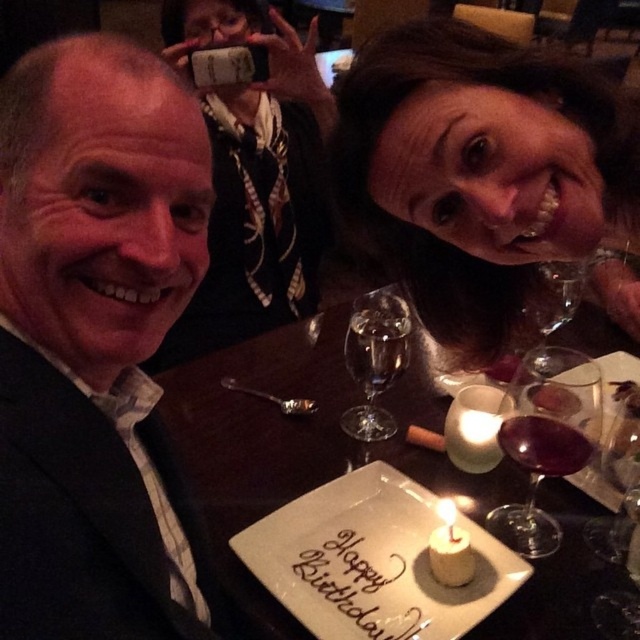
Between transparent glass wine glass at lower right and white wax candle at center, which one is positioned higher?

Positioned higher is transparent glass wine glass at lower right.

Is transparent glass wine glass at lower right smaller than white wax candle at center?

No.

This screenshot has width=640, height=640. I want to click on transparent glass wine glass at lower right, so click(x=620, y=477).

You are a GUI agent. You are given a task and a screenshot of the screen. Output one action in this format:
    pyautogui.click(x=<x>, y=<y>)
    Task: Click on the transparent glass wine glass at lower right
    The width and height of the screenshot is (640, 640).
    Given the screenshot: What is the action you would take?
    pyautogui.click(x=620, y=477)

Which of these two, clear glass wine glass at center or white wax candle at center, stands shorter?

With less height is white wax candle at center.

Can you confirm if clear glass wine glass at center is positioned above white wax candle at center?

Yes, clear glass wine glass at center is above white wax candle at center.

Locate an element on the screen. The image size is (640, 640). clear glass wine glass at center is located at coordinates (376, 358).

Between clear glass wine glass at upper right and white wax candle at center, which one has more height?

With more height is clear glass wine glass at upper right.

Who is shorter, clear glass wine glass at upper right or white wax candle at center?

white wax candle at center is shorter.

Between point (576, 273) and point (456, 556), which one is positioned behind?

The point (576, 273) is behind.

Locate an element on the screen. The height and width of the screenshot is (640, 640). clear glass wine glass at upper right is located at coordinates (552, 307).